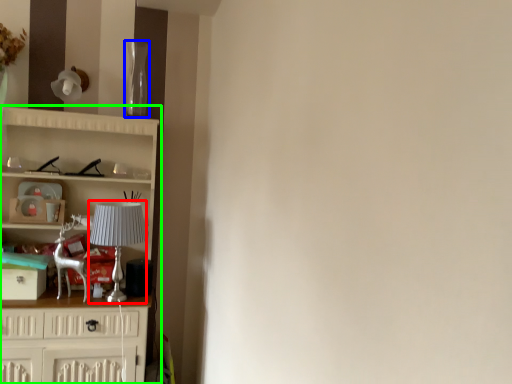
Question: Which object is positioned closest to lamp (highlighted by a red box)? Select from glass vase (highlighted by a blue box) and cupboard (highlighted by a green box).

Choices:
 (A) glass vase
 (B) cupboard

Answer: (B)